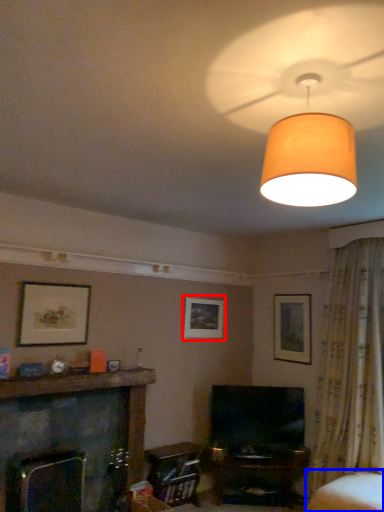
Question: Which object appears farthest to the camera in this image, picture frame (highlighted by a red box) or swivel chair (highlighted by a blue box)?

Choices:
 (A) picture frame
 (B) swivel chair

Answer: (A)